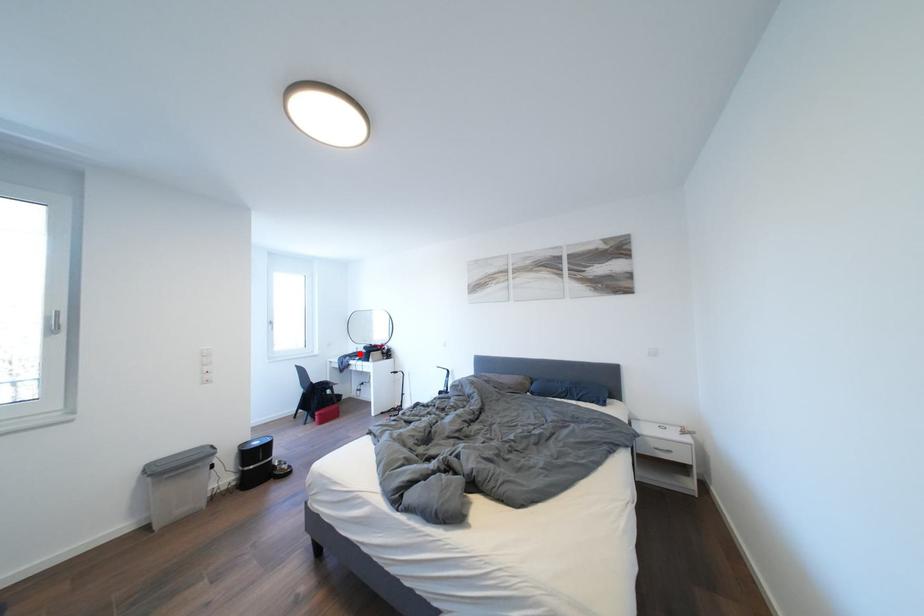
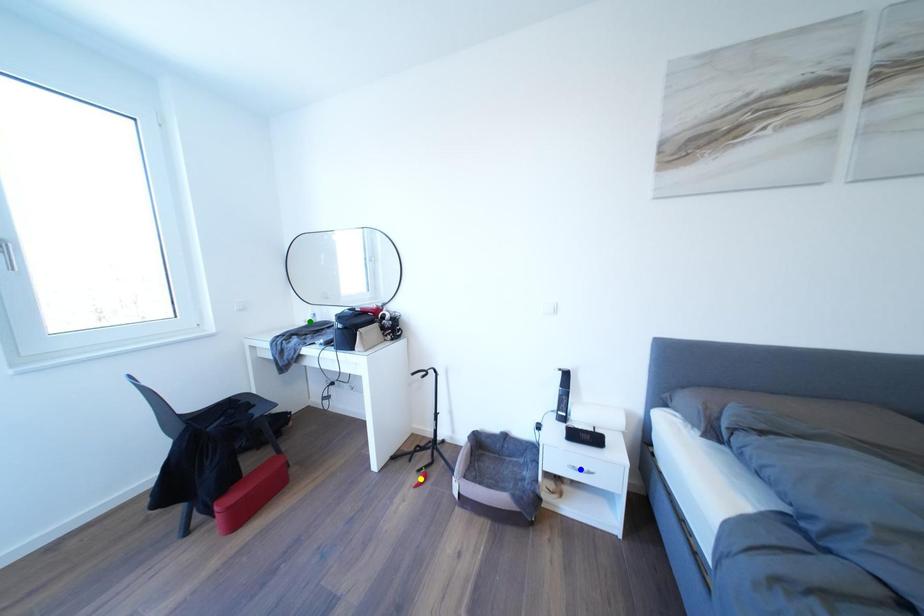
Question: I am providing you with two images of the same scene from different viewpoints. A red point is marked on the first image. You are given multiple points on the second image. In image 2, which mark is for the same physical point as the one in image 1?

Choices:
 (A) green point
 (B) yellow point
 (C) blue point

Answer: (A)